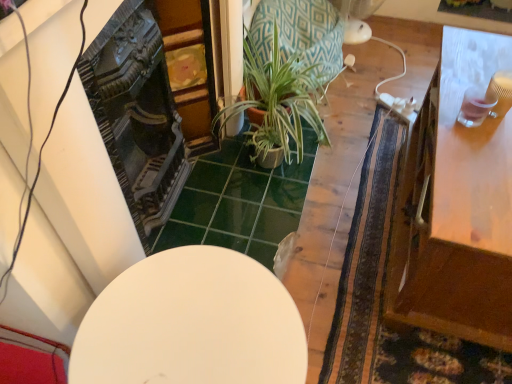
Question: From the image's perspective, would you say green textured pot at center is positioned over white matte table at center, which ranks as the first table in left-to-right order?

Choices:
 (A) yes
 (B) no

Answer: (A)

Question: Does green textured pot at center have a larger size compared to white matte table at center, which ranks as the first table in left-to-right order?

Choices:
 (A) no
 (B) yes

Answer: (B)

Question: From the image's perspective, is green textured pot at center beneath white matte table at center, which ranks as the first table in left-to-right order?

Choices:
 (A) yes
 (B) no

Answer: (B)

Question: Considering the relative sizes of green textured pot at center and white matte table at center, the second table positioned from the right, in the image provided, is green textured pot at center shorter than white matte table at center, the second table positioned from the right,?

Choices:
 (A) no
 (B) yes

Answer: (B)

Question: Is green textured pot at center located outside white matte table at center, which ranks as the first table in left-to-right order?

Choices:
 (A) yes
 (B) no

Answer: (A)

Question: Is green textured pot at center behind white matte table at center, which ranks as the first table in left-to-right order?

Choices:
 (A) yes
 (B) no

Answer: (A)

Question: Does wooden table at right, the first table from the right, have a greater width compared to white matte table at center, the second table positioned from the right?

Choices:
 (A) yes
 (B) no

Answer: (A)

Question: Is wooden table at right, the first table from the right, aimed at white matte table at center, the second table positioned from the right?

Choices:
 (A) yes
 (B) no

Answer: (B)

Question: Does wooden table at right, the first table from the right, have a smaller size compared to white matte table at center, the second table positioned from the right?

Choices:
 (A) no
 (B) yes

Answer: (A)

Question: Considering the relative positions of wooden table at right, marked as the second table in a left-to-right arrangement, and white matte table at center, the second table positioned from the right, in the image provided, is wooden table at right, marked as the second table in a left-to-right arrangement, in front of white matte table at center, the second table positioned from the right,?

Choices:
 (A) no
 (B) yes

Answer: (A)

Question: Is wooden table at right, the first table from the right, outside white matte table at center, which ranks as the first table in left-to-right order?

Choices:
 (A) no
 (B) yes

Answer: (B)

Question: Considering the relative positions of wooden table at right, the first table from the right, and white matte table at center, the second table positioned from the right, in the image provided, is wooden table at right, the first table from the right, behind white matte table at center, the second table positioned from the right,?

Choices:
 (A) yes
 (B) no

Answer: (A)

Question: From the image's perspective, is white matte table at center, the second table positioned from the right, above green textured pot at center?

Choices:
 (A) yes
 (B) no

Answer: (B)